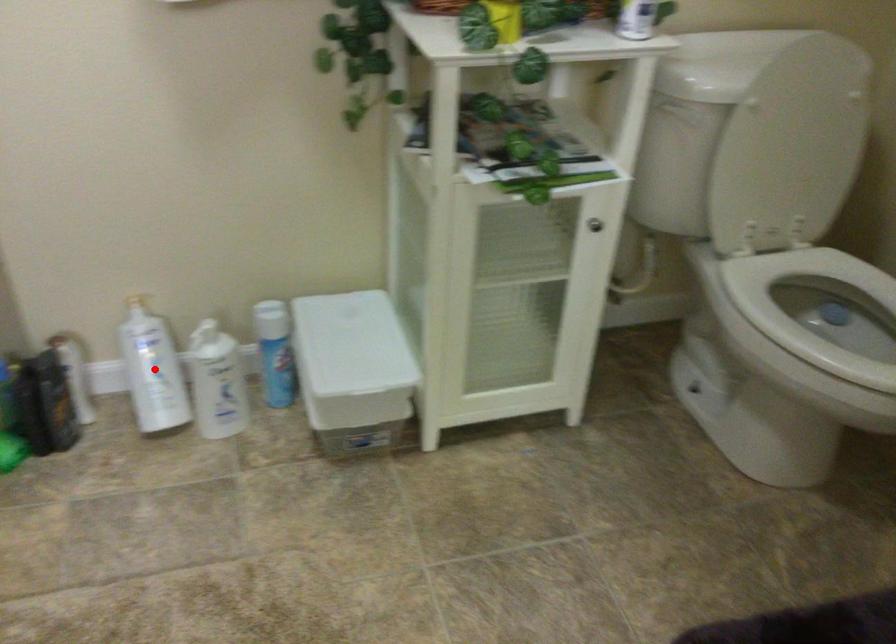
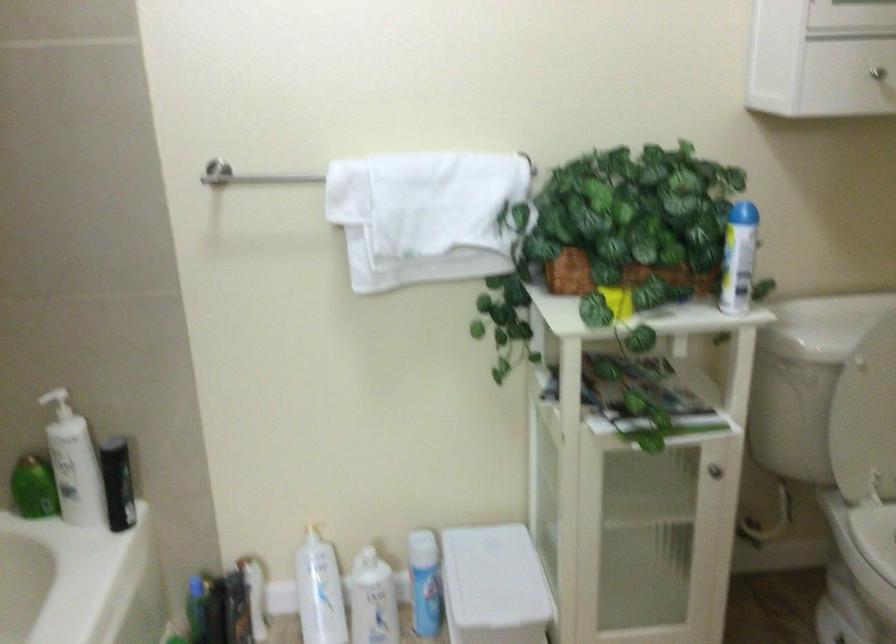
Where in the second image is the point corresponding to the highlighted location from the first image?

(319, 591)